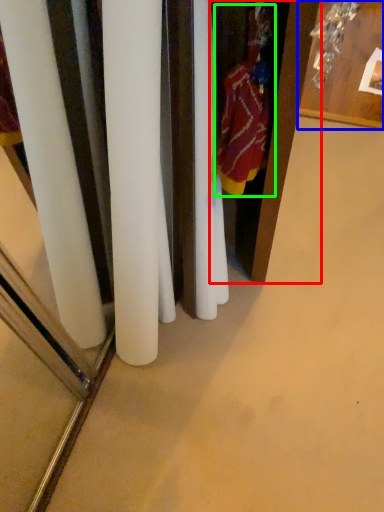
Question: Which is farther away from armoire (highlighted by a red box)? furniture (highlighted by a blue box) or clothing (highlighted by a green box)?

Choices:
 (A) furniture
 (B) clothing

Answer: (A)